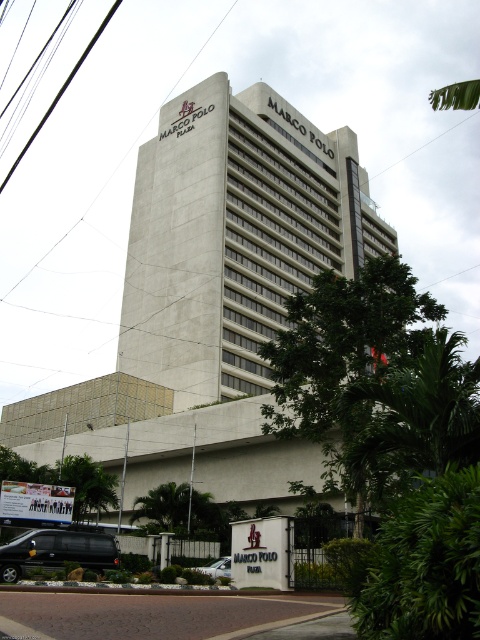
Is point (203, 323) closer to viewer compared to point (217, 560)?

That is False.

The width and height of the screenshot is (480, 640). I want to click on gray concrete building at center, so point(213,298).

Is gray concrete building at center positioned in front of black matte van at lower left?

No, it is not.

Which is behind, point (168, 305) or point (44, 534)?

The point (168, 305) is more distant.

Is point (202, 156) less distant than point (99, 547)?

No, it is behind (99, 547).

What are the coordinates of `gray concrete building at center` in the screenshot? It's located at (213, 298).

Is black matte van at lower left below silver metallic car at lower center?

Actually, black matte van at lower left is above silver metallic car at lower center.

Is black matte van at lower left shorter than silver metallic car at lower center?

In fact, black matte van at lower left may be taller than silver metallic car at lower center.

This screenshot has height=640, width=480. What do you see at coordinates (56, 552) in the screenshot? I see `black matte van at lower left` at bounding box center [56, 552].

In order to click on black matte van at lower left in this screenshot , I will do `click(56, 552)`.